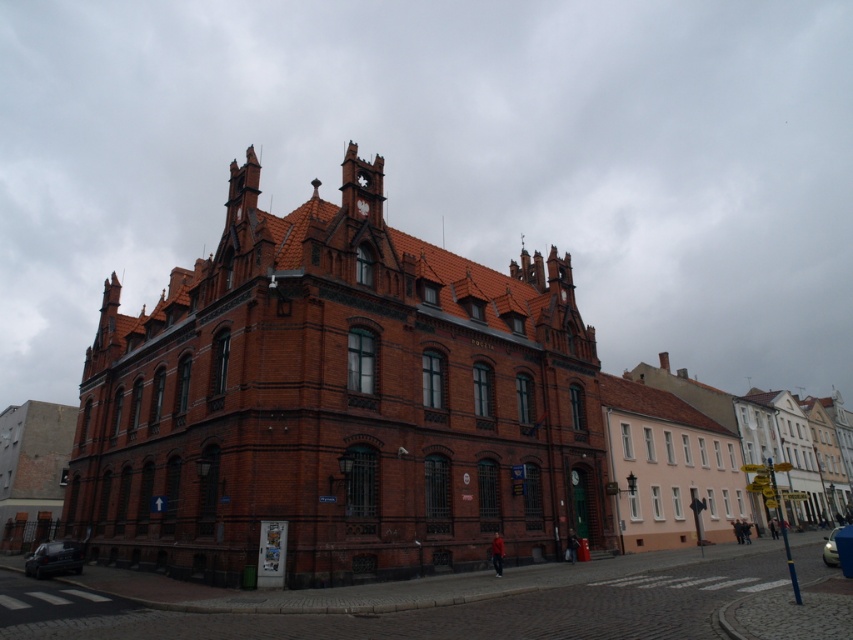
Which is more to the left, shiny black car at lower left or white glossy clock at upper center?

Positioned to the left is shiny black car at lower left.

Find the location of a particular element. The height and width of the screenshot is (640, 853). shiny black car at lower left is located at coordinates (54, 557).

Can you confirm if white glossy clock at upper center is wider than matte brown clock at center?

Incorrect, white glossy clock at upper center's width does not surpass matte brown clock at center's.

Can you confirm if white glossy clock at upper center is positioned to the left of matte brown clock at center?

Correct, you'll find white glossy clock at upper center to the left of matte brown clock at center.

Does point (364, 202) come closer to viewer compared to point (573, 468)?

Yes, it is.

At what (x,y) coordinates should I click in order to perform the action: click on white glossy clock at upper center. Please return your answer as a coordinate pair (x, y). This screenshot has width=853, height=640. Looking at the image, I should click on (363, 205).

Which is more to the right, shiny black car at lower left or shiny silver car at lower right?

Positioned to the right is shiny silver car at lower right.

Who is positioned more to the left, shiny black car at lower left or shiny silver car at lower right?

Positioned to the left is shiny black car at lower left.

Image resolution: width=853 pixels, height=640 pixels. Describe the element at coordinates (54, 557) in the screenshot. I see `shiny black car at lower left` at that location.

This screenshot has height=640, width=853. I want to click on shiny black car at lower left, so click(54, 557).